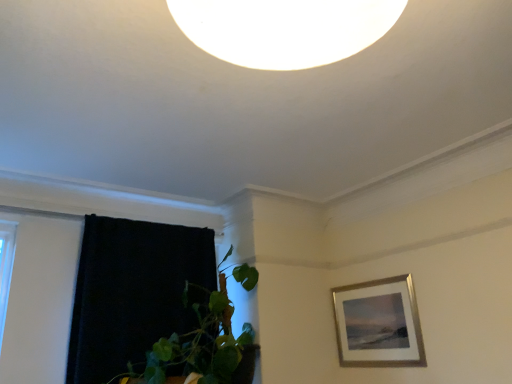
Question: Does silver/metallic picture frame at upper right have a greater height compared to green leafy plant at lower left?

Choices:
 (A) yes
 (B) no

Answer: (B)

Question: Does silver/metallic picture frame at upper right have a larger size compared to green leafy plant at lower left?

Choices:
 (A) no
 (B) yes

Answer: (A)

Question: Considering the relative positions of silver/metallic picture frame at upper right and green leafy plant at lower left in the image provided, is silver/metallic picture frame at upper right in front of green leafy plant at lower left?

Choices:
 (A) no
 (B) yes

Answer: (A)

Question: Would you consider silver/metallic picture frame at upper right to be distant from green leafy plant at lower left?

Choices:
 (A) yes
 (B) no

Answer: (B)

Question: Is silver/metallic picture frame at upper right completely or partially outside of green leafy plant at lower left?

Choices:
 (A) no
 (B) yes

Answer: (B)

Question: Can you confirm if silver/metallic picture frame at upper right is positioned to the left of green leafy plant at lower left?

Choices:
 (A) yes
 (B) no

Answer: (B)

Question: From the image's perspective, is green leafy plant at lower left on black velvet curtain at left?

Choices:
 (A) yes
 (B) no

Answer: (A)

Question: Does green leafy plant at lower left have a larger size compared to black velvet curtain at left?

Choices:
 (A) no
 (B) yes

Answer: (B)

Question: Can black velvet curtain at left be found inside green leafy plant at lower left?

Choices:
 (A) no
 (B) yes

Answer: (B)

Question: Is green leafy plant at lower left oriented away from black velvet curtain at left?

Choices:
 (A) no
 (B) yes

Answer: (B)

Question: Can you confirm if green leafy plant at lower left is smaller than black velvet curtain at left?

Choices:
 (A) yes
 (B) no

Answer: (B)

Question: Is green leafy plant at lower left located outside black velvet curtain at left?

Choices:
 (A) yes
 (B) no

Answer: (A)

Question: Can we say black velvet curtain at left lies outside silver/metallic picture frame at upper right?

Choices:
 (A) yes
 (B) no

Answer: (A)